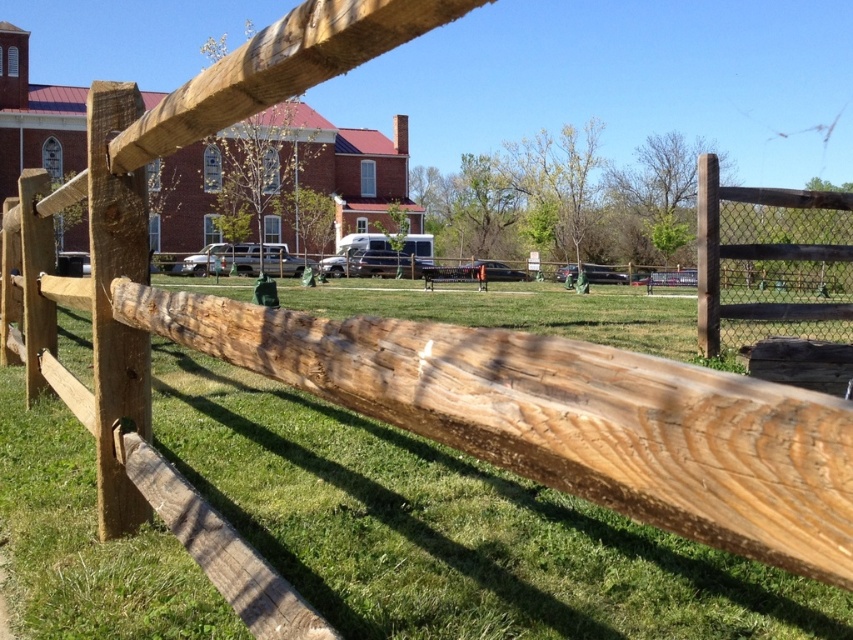
Question: Which of the following is the farthest from the observer?

Choices:
 (A) green grass at center
 (B) brown wooden fence at right

Answer: (B)

Question: Does green grass at center have a larger size compared to brown wooden fence at right?

Choices:
 (A) no
 (B) yes

Answer: (B)

Question: Is green grass at center closer to the viewer compared to brown wooden fence at right?

Choices:
 (A) no
 (B) yes

Answer: (B)

Question: Does green grass at center have a greater width compared to brown wooden fence at right?

Choices:
 (A) no
 (B) yes

Answer: (B)

Question: Among these points, which one is farthest from the camera?

Choices:
 (A) (784, 198)
 (B) (554, 600)

Answer: (A)